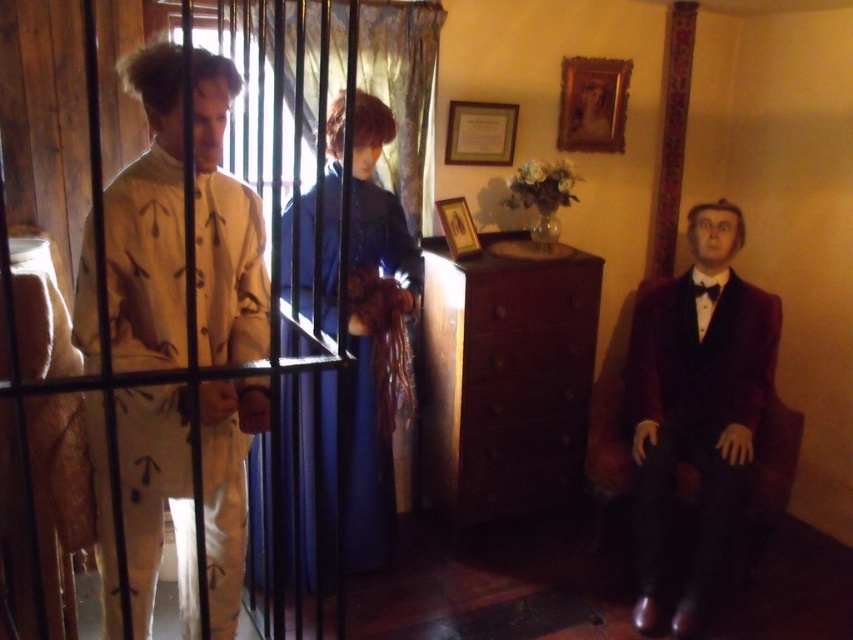
Does velvet dark suit at right lie in front of black satin bow tie at right?

That is True.

Between point (683, 611) and point (691, 282), which one is positioned in front?

Point (683, 611)

Describe the element at coordinates (695, 406) in the screenshot. I see `velvet dark suit at right` at that location.

You are a GUI agent. You are given a task and a screenshot of the screen. Output one action in this format:
    pyautogui.click(x=<x>, y=<y>)
    Task: Click on the velvet dark suit at right
    The image size is (853, 640).
    Given the screenshot: What is the action you would take?
    pyautogui.click(x=695, y=406)

Is point (131, 337) farther from viewer compared to point (282, 531)?

No, (131, 337) is in front of (282, 531).

Who is more forward, (334, 412) or (332, 547)?

Point (334, 412) is in front.

Is point (316, 3) positioned behind point (386, 422)?

No, it is in front of (386, 422).

Find the location of a particular element. The image size is (853, 640). brushed metal cage at left is located at coordinates (144, 266).

Between brushed metal cage at left and velvet dark suit at right, which one is positioned lower?

velvet dark suit at right is lower down.

Which is more to the left, brushed metal cage at left or velvet dark suit at right?

brushed metal cage at left

Who is more distant from viewer, (305,272) or (653,588)?

Point (653,588)

I want to click on brushed metal cage at left, so click(144, 266).